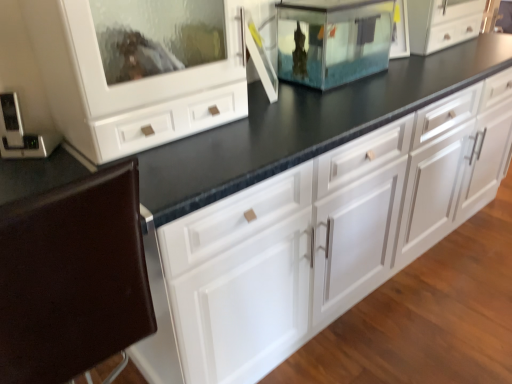
The image size is (512, 384). I want to click on metallic silver thermostat at left, the second appliance viewed from the top, so click(x=22, y=133).

How much space does metallic silver thermostat at left, the 1th appliance in the front-to-back sequence, occupy vertically?

metallic silver thermostat at left, the 1th appliance in the front-to-back sequence, is 16.28 centimeters in height.

What do you see at coordinates (72, 278) in the screenshot? I see `brown leather chair at lower left` at bounding box center [72, 278].

Measure the distance between white glossy cabinet at center and camera.

The depth of white glossy cabinet at center is 34.80 inches.

Locate an element on the screen. metallic silver thermostat at left, the second appliance viewed from the top is located at coordinates (22, 133).

Would you say transparent glass fish tank at center, acting as the 2th appliance starting from the front, is inside or outside white glossy cabinet at center?

transparent glass fish tank at center, acting as the 2th appliance starting from the front, lies outside white glossy cabinet at center.

How many degrees apart are the facing directions of transparent glass fish tank at center, which ranks as the second appliance in bottom-to-top order, and white glossy cabinet at center?

The angle between the facing direction of transparent glass fish tank at center, which ranks as the second appliance in bottom-to-top order, and the facing direction of white glossy cabinet at center is 88.8 degrees.

Which of these two, transparent glass fish tank at center, acting as the 2th appliance starting from the front, or white glossy cabinet at center, is bigger?

Bigger between the two is white glossy cabinet at center.

From a real-world perspective, is transparent glass fish tank at center, which ranks as the second appliance in bottom-to-top order, physically above white glossy cabinet at center?

Yes, from a real-world perspective, transparent glass fish tank at center, which ranks as the second appliance in bottom-to-top order, is above white glossy cabinet at center.

This screenshot has height=384, width=512. Identify the location of the chest of drawers located underneath the transparent glass fish tank at center, arranged as the 1th appliance when viewed from the right (from a real-world perspective). (316, 238).

From a real-world perspective, which object stands above the other?

In real-world perspective, transparent glass fish tank at center, acting as the 2th appliance starting from the front, is above.

Which is nearer, (x=156, y=257) or (x=333, y=24)?

The point (x=156, y=257) is in front.

Who is shorter, white glossy cabinet at center or transparent glass fish tank at center, which ranks as the first appliance in top-to-bottom order?

white glossy cabinet at center.

From a real-world perspective, is transparent glass fish tank at center, acting as the 2th appliance starting from the front, above or below metallic silver thermostat at left, the 1th appliance in the front-to-back sequence?

transparent glass fish tank at center, acting as the 2th appliance starting from the front, is situated higher than metallic silver thermostat at left, the 1th appliance in the front-to-back sequence, in the real world.

Considering the positions of points (305, 12) and (52, 138), is point (305, 12) farther from camera compared to point (52, 138)?

Yes.

Who is bigger, transparent glass fish tank at center, the 2th appliance when ordered from left to right, or metallic silver thermostat at left, which appears as the 1th appliance when ordered from the bottom?

Bigger between the two is transparent glass fish tank at center, the 2th appliance when ordered from left to right.

Between transparent glass fish tank at center, which ranks as the second appliance in bottom-to-top order, and metallic silver thermostat at left, the second appliance viewed from the top, which one has smaller width?

Thinner between the two is metallic silver thermostat at left, the second appliance viewed from the top.

This screenshot has width=512, height=384. Identify the location of cabinetry lying on the right of metallic silver thermostat at left, which appears as the 1th appliance when ordered from the bottom. (72, 278).

Is metallic silver thermostat at left, marked as the 2th appliance in a right-to-left arrangement, to the right of brown leather chair at lower left from the viewer's perspective?

Incorrect, metallic silver thermostat at left, marked as the 2th appliance in a right-to-left arrangement, is not on the right side of brown leather chair at lower left.

Who is bigger, metallic silver thermostat at left, the second appliance in the back-to-front sequence, or brown leather chair at lower left?

With larger size is brown leather chair at lower left.

In terms of height, does metallic silver thermostat at left, the second appliance in the back-to-front sequence, look taller or shorter compared to brown leather chair at lower left?

In the image, metallic silver thermostat at left, the second appliance in the back-to-front sequence, appears to be shorter than brown leather chair at lower left.

Can you confirm if metallic silver thermostat at left, the second appliance viewed from the top, is wider than transparent glass fish tank at center, the 2th appliance when ordered from left to right?

No.

From the image's perspective, which one is positioned lower, metallic silver thermostat at left, the second appliance viewed from the top, or transparent glass fish tank at center, which ranks as the second appliance in bottom-to-top order?

metallic silver thermostat at left, the second appliance viewed from the top, from the image's perspective.

Considering the positions of point (54, 137) and point (374, 38), is point (54, 137) closer or farther from the camera than point (374, 38)?

Point (54, 137).

Which object is positioned more to the left, metallic silver thermostat at left, the second appliance viewed from the top, or transparent glass fish tank at center, the 1th appliance viewed from the back?

From the viewer's perspective, metallic silver thermostat at left, the second appliance viewed from the top, appears more on the left side.

Would you say brown leather chair at lower left is inside or outside metallic silver thermostat at left, the second appliance in the back-to-front sequence?

brown leather chair at lower left is spatially situated outside metallic silver thermostat at left, the second appliance in the back-to-front sequence.

Based on the photo, from a real-world perspective, is brown leather chair at lower left over metallic silver thermostat at left, the second appliance viewed from the top?

Incorrect, from a real-world perspective, brown leather chair at lower left is lower than metallic silver thermostat at left, the second appliance viewed from the top.

From the picture: Could you tell me if brown leather chair at lower left is facing metallic silver thermostat at left, the second appliance in the back-to-front sequence?

No, brown leather chair at lower left is not aimed at metallic silver thermostat at left, the second appliance in the back-to-front sequence.

Would you consider brown leather chair at lower left to be distant from metallic silver thermostat at left, the 1th appliance in the front-to-back sequence?

They are positioned close to each other.

Which is more to the left, white glossy cabinet at center or metallic silver thermostat at left, the 1th appliance in the front-to-back sequence?

metallic silver thermostat at left, the 1th appliance in the front-to-back sequence, is more to the left.

Considering the relative sizes of white glossy cabinet at center and metallic silver thermostat at left, marked as the 2th appliance in a right-to-left arrangement, in the image provided, is white glossy cabinet at center wider than metallic silver thermostat at left, marked as the 2th appliance in a right-to-left arrangement,?

Indeed, white glossy cabinet at center has a greater width compared to metallic silver thermostat at left, marked as the 2th appliance in a right-to-left arrangement.

Is white glossy cabinet at center positioned with its back to metallic silver thermostat at left, the second appliance in the back-to-front sequence?

No, white glossy cabinet at center is not facing the opposite direction of metallic silver thermostat at left, the second appliance in the back-to-front sequence.

Between white glossy cabinet at center and metallic silver thermostat at left, which appears as the 1th appliance when ordered from the bottom, which one is positioned in front?

white glossy cabinet at center is more forward.

You are a GUI agent. You are given a task and a screenshot of the screen. Output one action in this format:
    pyautogui.click(x=<x>, y=<y>)
    Task: Click on the chest of drawers lying on the right of transparent glass fish tank at center, acting as the 2th appliance starting from the front
    Image resolution: width=512 pixels, height=384 pixels.
    Given the screenshot: What is the action you would take?
    pyautogui.click(x=316, y=238)

Where is `the chest of drawers in front of the transparent glass fish tank at center, which ranks as the second appliance in bottom-to-top order`? This screenshot has height=384, width=512. the chest of drawers in front of the transparent glass fish tank at center, which ranks as the second appliance in bottom-to-top order is located at coordinates (316, 238).

Considering their positions, is white glossy cabinet at center positioned further to transparent glass fish tank at center, acting as the 2th appliance starting from the front, than brown leather chair at lower left?

brown leather chair at lower left is positioned further to the anchor transparent glass fish tank at center, acting as the 2th appliance starting from the front.

Which object lies further to the anchor point white glossy cabinet at center, brown leather chair at lower left or transparent glass fish tank at center, arranged as the 1th appliance when viewed from the right?

transparent glass fish tank at center, arranged as the 1th appliance when viewed from the right.

Looking at the image, which one is located further to transparent glass fish tank at center, acting as the 2th appliance starting from the front, white glossy cabinet at center or metallic silver thermostat at left, the second appliance viewed from the top?

The object further to transparent glass fish tank at center, acting as the 2th appliance starting from the front, is metallic silver thermostat at left, the second appliance viewed from the top.

When comparing their distances from brown leather chair at lower left, does metallic silver thermostat at left, the second appliance viewed from the top, or white glossy cabinet at center seem further?

metallic silver thermostat at left, the second appliance viewed from the top, is further to brown leather chair at lower left.

Estimate the real-world distances between objects in this image. Which object is closer to white glossy cabinet at center, metallic silver thermostat at left, the second appliance in the back-to-front sequence, or brown leather chair at lower left?

brown leather chair at lower left is closer to white glossy cabinet at center.

From the image, which object appears to be nearer to white glossy cabinet at center, metallic silver thermostat at left, the second appliance in the back-to-front sequence, or transparent glass fish tank at center, the 1th appliance viewed from the back?

transparent glass fish tank at center, the 1th appliance viewed from the back, is closer to white glossy cabinet at center.

Looking at the image, which one is located closer to brown leather chair at lower left, white glossy cabinet at center or transparent glass fish tank at center, which ranks as the first appliance in top-to-bottom order?

white glossy cabinet at center is positioned closer to the anchor brown leather chair at lower left.

Based on their spatial positions, is brown leather chair at lower left or transparent glass fish tank at center, arranged as the 1th appliance when viewed from the right, closer to metallic silver thermostat at left, the second appliance in the back-to-front sequence?

brown leather chair at lower left.

Image resolution: width=512 pixels, height=384 pixels. In order to click on appliance between brown leather chair at lower left and white glossy cabinet at center in the horizontal direction in this screenshot , I will do `click(333, 40)`.

Find the location of a particular element. This screenshot has width=512, height=384. cabinetry between metallic silver thermostat at left, the second appliance in the back-to-front sequence, and white glossy cabinet at center, in the horizontal direction is located at coordinates (72, 278).

Locate an element on the screen. cabinetry situated between metallic silver thermostat at left, the second appliance viewed from the top, and transparent glass fish tank at center, which ranks as the first appliance in top-to-bottom order, from left to right is located at coordinates (72, 278).

Where is `appliance between metallic silver thermostat at left, marked as the 2th appliance in a right-to-left arrangement, and white glossy cabinet at center`? This screenshot has width=512, height=384. appliance between metallic silver thermostat at left, marked as the 2th appliance in a right-to-left arrangement, and white glossy cabinet at center is located at coordinates 333,40.